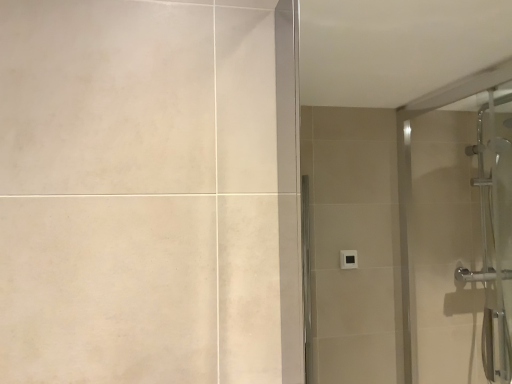
Identify the location of transparent glass door at right. (413, 234).

Image resolution: width=512 pixels, height=384 pixels. What do you see at coordinates (413, 234) in the screenshot?
I see `transparent glass door at right` at bounding box center [413, 234].

This screenshot has width=512, height=384. In order to click on transparent glass door at right in this screenshot , I will do `click(413, 234)`.